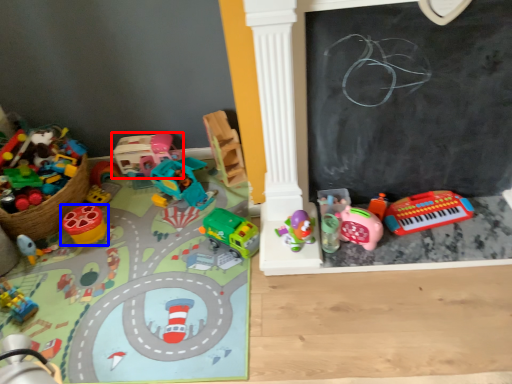
Question: Which object appears closest to the camera in this image, toy (highlighted by a red box) or toy (highlighted by a blue box)?

Choices:
 (A) toy
 (B) toy

Answer: (B)